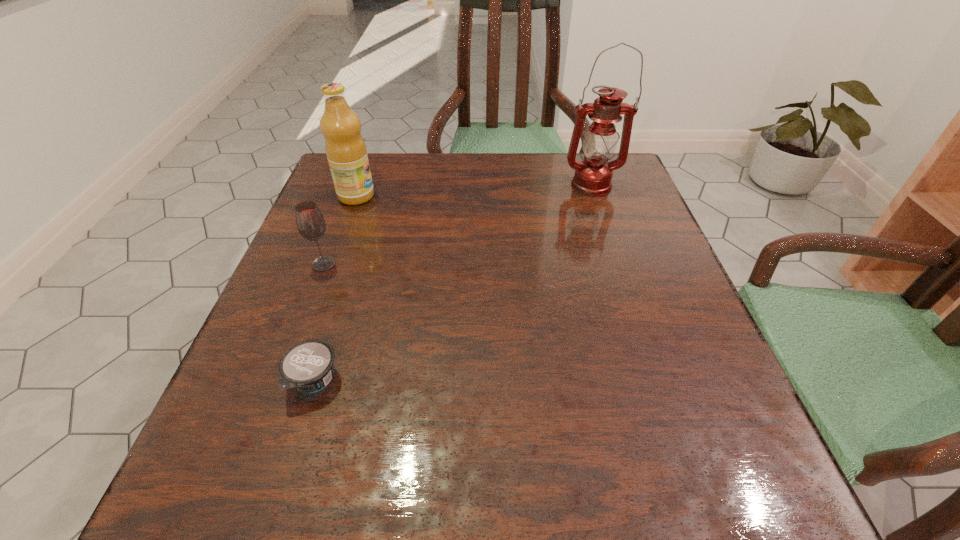
The height and width of the screenshot is (540, 960). Find the location of `free space at the left edge of the desktop`. free space at the left edge of the desktop is located at coordinates (264, 402).

Where is `free space at the right edge of the desktop`? free space at the right edge of the desktop is located at coordinates (647, 230).

You are a GUI agent. You are given a task and a screenshot of the screen. Output one action in this format:
    pyautogui.click(x=<x>, y=<y>)
    Task: Click on the vacant space at the near left corner of the desktop
    The height and width of the screenshot is (540, 960).
    Given the screenshot: What is the action you would take?
    pyautogui.click(x=314, y=456)

At what (x,y) coordinates should I click in order to perform the action: click on free point at the far right corner. Please return your answer as a coordinate pair (x, y). The width and height of the screenshot is (960, 540). Looking at the image, I should click on (613, 184).

This screenshot has width=960, height=540. I want to click on vacant area at the near right corner of the desktop, so click(x=692, y=497).

Locate an element on the screen. unoccupied position between the second tallest object and the rightmost object is located at coordinates (473, 191).

Where is `free space that is in between the third farthest object and the olive oil`? This screenshot has height=540, width=960. free space that is in between the third farthest object and the olive oil is located at coordinates (340, 230).

Locate an element on the screen. The width and height of the screenshot is (960, 540). unoccupied position between the nearest object and the third farthest object is located at coordinates pyautogui.click(x=319, y=322).

This screenshot has height=540, width=960. I want to click on free space between the yogurt and the third shortest object, so pyautogui.click(x=335, y=288).

The height and width of the screenshot is (540, 960). I want to click on vacant space that's between the glass drink container and the oil lamp, so click(457, 225).